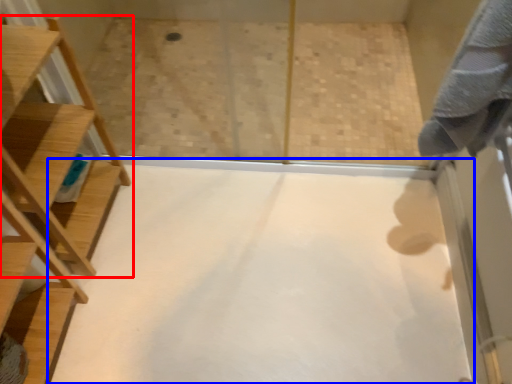
Question: Which object is further to the camera taking this photo, furniture (highlighted by a red box) or plain (highlighted by a blue box)?

Choices:
 (A) furniture
 (B) plain

Answer: (B)